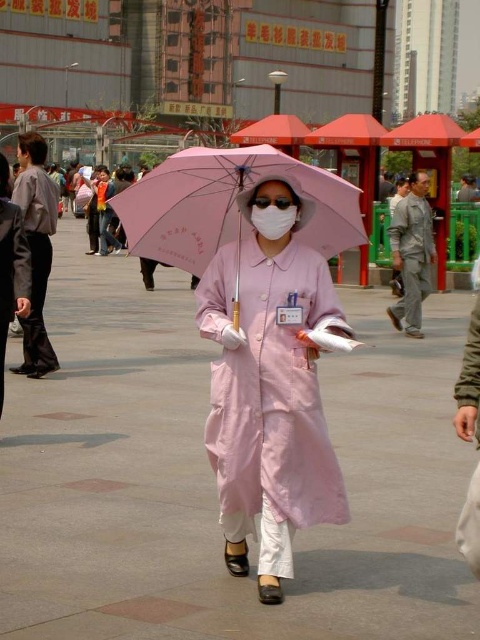
Can you confirm if pink fabric umbrella at center is positioned to the left of white matte mask at center?

Indeed, pink fabric umbrella at center is positioned on the left side of white matte mask at center.

Which is more to the right, pink fabric umbrella at center or white matte mask at center?

white matte mask at center is more to the right.

Image resolution: width=480 pixels, height=640 pixels. I want to click on pink fabric umbrella at center, so click(230, 205).

Where is `pink fabric umbrella at center`? This screenshot has height=640, width=480. pink fabric umbrella at center is located at coordinates (230, 205).

Who is positioned more to the left, matte pink coat at center or matte gray robe at left?

matte gray robe at left

Can you confirm if matte pink coat at center is smaller than matte gray robe at left?

Incorrect, matte pink coat at center is not smaller in size than matte gray robe at left.

Between point (217, 449) and point (44, 253), which one is positioned behind?

Positioned behind is point (44, 253).

At what (x,y) coordinates should I click in order to perform the action: click on matte pink coat at center. Please return your answer as a coordinate pair (x, y). The height and width of the screenshot is (640, 480). Looking at the image, I should click on (271, 392).

Between point (241, 538) and point (312, 179), which one is positioned behind?

The point (312, 179) is behind.

Does matte pink coat at center lie in front of pink fabric umbrella at center?

Yes, matte pink coat at center is in front of pink fabric umbrella at center.

Find the location of a particular element. Image resolution: width=480 pixels, height=640 pixels. matte pink coat at center is located at coordinates (271, 392).

Image resolution: width=480 pixels, height=640 pixels. I want to click on matte pink coat at center, so click(271, 392).